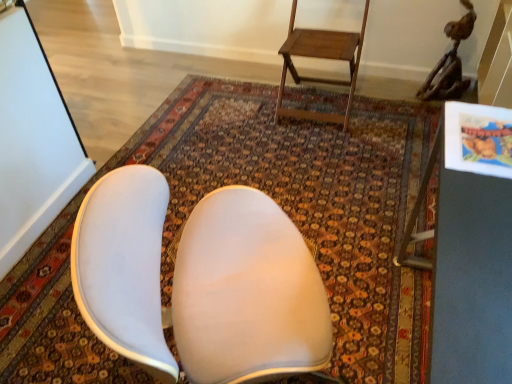
Image resolution: width=512 pixels, height=384 pixels. Identify the location of vacant space underneath carpeted rug at center (from a real-world perspective). (286, 180).